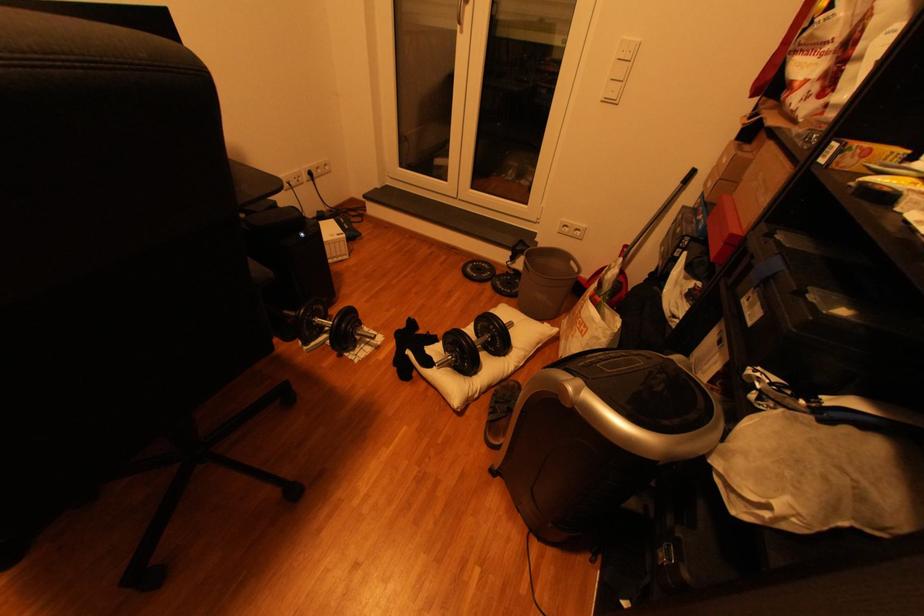
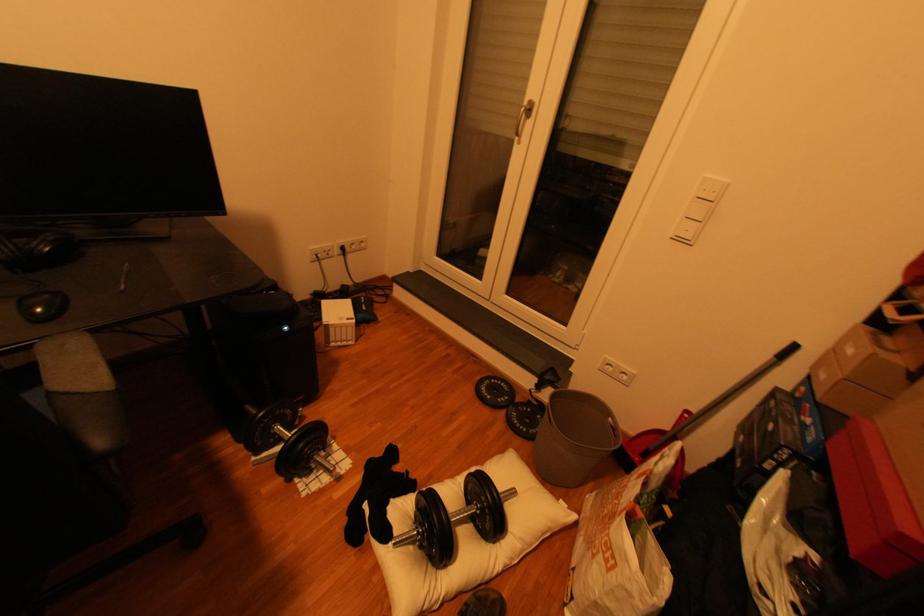
Locate, in the second image, the point that corresponds to the point at 614,100 in the first image.

(687, 240)